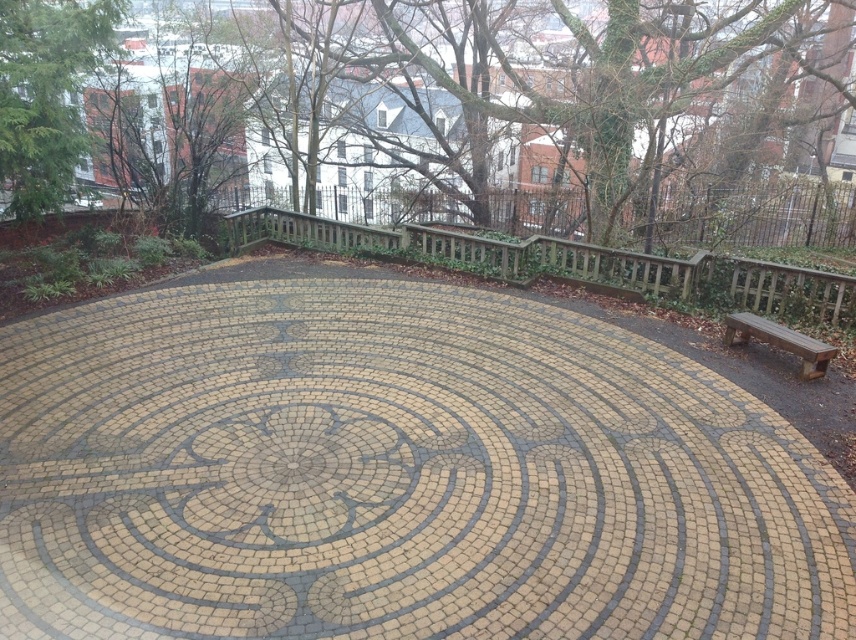
Question: Which point appears closest to the camera in this image?

Choices:
 (A) (807, 269)
 (B) (827, 355)

Answer: (B)

Question: In this image, where is wooden at center located relative to brown wooden bench at lower right?

Choices:
 (A) below
 (B) above

Answer: (B)

Question: From the image, what is the correct spatial relationship of wooden at center in relation to brown wooden bench at lower right?

Choices:
 (A) below
 (B) above

Answer: (B)

Question: Which point is farther to the camera?

Choices:
 (A) (813, 339)
 (B) (718, 305)

Answer: (B)

Question: Does wooden at center appear on the right side of brown wooden bench at lower right?

Choices:
 (A) no
 (B) yes

Answer: (A)